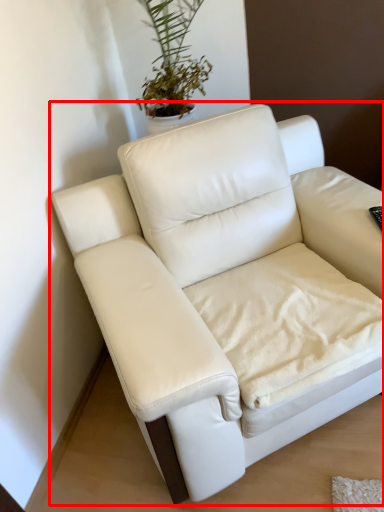
Question: From the image's perspective, where is studio couch (annotated by the red box) located in relation to sheet in the image?

Choices:
 (A) above
 (B) below

Answer: (A)